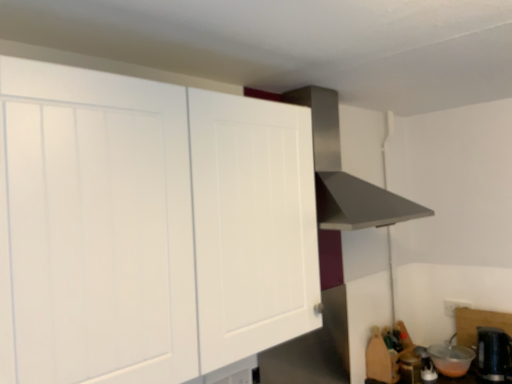
What do you see at coordinates (494, 354) in the screenshot? The width and height of the screenshot is (512, 384). I see `black plastic kettle at lower right, the fourth appliance positioned from the left` at bounding box center [494, 354].

Image resolution: width=512 pixels, height=384 pixels. What do you see at coordinates (410, 368) in the screenshot?
I see `metallic silver toaster at lower right, placed as the first appliance when sorted from left to right` at bounding box center [410, 368].

How much space does white glossy kettle at lower right, which is the 3th appliance in right-to-left order, occupy vertically?

white glossy kettle at lower right, which is the 3th appliance in right-to-left order, is 3.11 inches tall.

I want to click on white matte cabinet at upper left, so click(x=148, y=227).

From the image's perspective, would you say metallic silver toaster at lower right, placed as the first appliance when sorted from left to right, is shown under white glossy kettle at lower right, acting as the 2th appliance starting from the left?

No, from the image's perspective, metallic silver toaster at lower right, placed as the first appliance when sorted from left to right, is not beneath white glossy kettle at lower right, acting as the 2th appliance starting from the left.

Considering the sizes of objects metallic silver toaster at lower right, placed as the first appliance when sorted from left to right, and white glossy kettle at lower right, which is the 3th appliance in right-to-left order, in the image provided, who is thinner, metallic silver toaster at lower right, placed as the first appliance when sorted from left to right, or white glossy kettle at lower right, which is the 3th appliance in right-to-left order,?

white glossy kettle at lower right, which is the 3th appliance in right-to-left order.

Identify the location of the 2nd appliance located beneath the metallic silver toaster at lower right, which is the 4th appliance in right-to-left order (from a real-world perspective). pos(426,365).

Which of these two, transparent plastic bowl at lower right, the 2th appliance viewed from the right, or metallic silver toaster at lower right, which is the 4th appliance in right-to-left order, stands shorter?

transparent plastic bowl at lower right, the 2th appliance viewed from the right, is shorter.

Would you say transparent plastic bowl at lower right, which appears as the third appliance when viewed from the left, is outside metallic silver toaster at lower right, placed as the first appliance when sorted from left to right?

transparent plastic bowl at lower right, which appears as the third appliance when viewed from the left, lies outside metallic silver toaster at lower right, placed as the first appliance when sorted from left to right,'s area.

Which is in front, transparent plastic bowl at lower right, the 2th appliance viewed from the right, or metallic silver toaster at lower right, which is the 4th appliance in right-to-left order?

Positioned in front is metallic silver toaster at lower right, which is the 4th appliance in right-to-left order.

Which of these two, transparent plastic bowl at lower right, which appears as the third appliance when viewed from the left, or metallic silver toaster at lower right, which is the 4th appliance in right-to-left order, is smaller?

With smaller size is metallic silver toaster at lower right, which is the 4th appliance in right-to-left order.

Can you confirm if white glossy kettle at lower right, which is the 3th appliance in right-to-left order, is taller than black plastic kettle at lower right, the fourth appliance positioned from the left?

Incorrect, the height of white glossy kettle at lower right, which is the 3th appliance in right-to-left order, is not larger of that of black plastic kettle at lower right, the fourth appliance positioned from the left.

Which appliance is the 3rd one when counting from the front of the white glossy kettle at lower right, acting as the 2th appliance starting from the left? Please provide its 2D coordinates.

[(494, 354)]

Does white glossy kettle at lower right, which is the 3th appliance in right-to-left order, have a smaller size compared to black plastic kettle at lower right, the fourth appliance positioned from the left?

Correct, white glossy kettle at lower right, which is the 3th appliance in right-to-left order, occupies less space than black plastic kettle at lower right, the fourth appliance positioned from the left.

Is white glossy kettle at lower right, acting as the 2th appliance starting from the left, directly adjacent to black plastic kettle at lower right, which ranks as the 1th appliance in right-to-left order?

No, white glossy kettle at lower right, acting as the 2th appliance starting from the left, is not making contact with black plastic kettle at lower right, which ranks as the 1th appliance in right-to-left order.

Is stainless steel vent at upper center at the right side of white glossy kettle at lower right, acting as the 2th appliance starting from the left?

No, stainless steel vent at upper center is not to the right of white glossy kettle at lower right, acting as the 2th appliance starting from the left.

From the picture: Relative to white glossy kettle at lower right, acting as the 2th appliance starting from the left, is stainless steel vent at upper center in front or behind?

In the image, stainless steel vent at upper center appears in front of white glossy kettle at lower right, acting as the 2th appliance starting from the left.

Is white glossy kettle at lower right, which is the 3th appliance in right-to-left order, inside stainless steel vent at upper center?

No, stainless steel vent at upper center does not contain white glossy kettle at lower right, which is the 3th appliance in right-to-left order.

At what (x,y) coordinates should I click in order to perform the action: click on vent above the white glossy kettle at lower right, which is the 3th appliance in right-to-left order (from the image's perspective). Please return your answer as a coordinate pair (x, y). This screenshot has width=512, height=384. Looking at the image, I should click on (345, 174).

What's the angular difference between transparent plastic bowl at lower right, which appears as the third appliance when viewed from the left, and white glossy kettle at lower right, acting as the 2th appliance starting from the left,'s facing directions?

0.00352 degrees.

Does transparent plastic bowl at lower right, which appears as the third appliance when viewed from the left, touch white glossy kettle at lower right, acting as the 2th appliance starting from the left?

No, transparent plastic bowl at lower right, which appears as the third appliance when viewed from the left, is not next to white glossy kettle at lower right, acting as the 2th appliance starting from the left.

Find the location of a particular element. Image resolution: width=512 pixels, height=384 pixels. appliance that is the 1st one above the white glossy kettle at lower right, which is the 3th appliance in right-to-left order (from a real-world perspective) is located at coordinates (451, 359).

Is transparent plastic bowl at lower right, the 2th appliance viewed from the right, looking in the opposite direction of stainless steel vent at upper center?

That's not correct — transparent plastic bowl at lower right, the 2th appliance viewed from the right, is not looking away from stainless steel vent at upper center.

Considering the relative positions of transparent plastic bowl at lower right, which appears as the third appliance when viewed from the left, and stainless steel vent at upper center in the image provided, is transparent plastic bowl at lower right, which appears as the third appliance when viewed from the left, in front of stainless steel vent at upper center?

No, transparent plastic bowl at lower right, which appears as the third appliance when viewed from the left, is further to the viewer.

In terms of width, does transparent plastic bowl at lower right, which appears as the third appliance when viewed from the left, look wider or thinner when compared to stainless steel vent at upper center?

Clearly, transparent plastic bowl at lower right, which appears as the third appliance when viewed from the left, has less width compared to stainless steel vent at upper center.

From a real-world perspective, is transparent plastic bowl at lower right, which appears as the third appliance when viewed from the left, physically located above or below stainless steel vent at upper center?

transparent plastic bowl at lower right, which appears as the third appliance when viewed from the left, is below stainless steel vent at upper center.

In order to click on appliance that is the 4th one when counting downward from the stainless steel vent at upper center (from the image's perspective) in this screenshot , I will do `click(426, 365)`.

What's the angular difference between white glossy kettle at lower right, acting as the 2th appliance starting from the left, and stainless steel vent at upper center's facing directions?

white glossy kettle at lower right, acting as the 2th appliance starting from the left, and stainless steel vent at upper center are facing 88.5 degrees away from each other.

Consider the image. Between white glossy kettle at lower right, acting as the 2th appliance starting from the left, and stainless steel vent at upper center, which one has smaller size?

white glossy kettle at lower right, acting as the 2th appliance starting from the left, is smaller.

Looking at their sizes, would you say white glossy kettle at lower right, acting as the 2th appliance starting from the left, is wider or thinner than stainless steel vent at upper center?

Considering their sizes, white glossy kettle at lower right, acting as the 2th appliance starting from the left, looks slimmer than stainless steel vent at upper center.

From the image's perspective, count 1st appliances upward from the white glossy kettle at lower right, which is the 3th appliance in right-to-left order, and point to it. Please provide its 2D coordinates.

[(410, 368)]

In order to click on appliance that is the 1st object above the transparent plastic bowl at lower right, which appears as the third appliance when viewed from the left (from a real-world perspective) in this screenshot , I will do `click(410, 368)`.

When comparing their distances from white matte cabinet at upper left, does stainless steel vent at upper center or black plastic kettle at lower right, which ranks as the 1th appliance in right-to-left order, seem further?

Among the two, black plastic kettle at lower right, which ranks as the 1th appliance in right-to-left order, is located further to white matte cabinet at upper left.

From the image, which object appears to be nearer to metallic silver toaster at lower right, placed as the first appliance when sorted from left to right, white glossy kettle at lower right, which is the 3th appliance in right-to-left order, or transparent plastic bowl at lower right, which appears as the third appliance when viewed from the left?

Among the two, white glossy kettle at lower right, which is the 3th appliance in right-to-left order, is located nearer to metallic silver toaster at lower right, placed as the first appliance when sorted from left to right.

Estimate the real-world distances between objects in this image. Which object is further from white glossy kettle at lower right, acting as the 2th appliance starting from the left, transparent plastic bowl at lower right, which appears as the third appliance when viewed from the left, or metallic silver toaster at lower right, which is the 4th appliance in right-to-left order?

Among the two, transparent plastic bowl at lower right, which appears as the third appliance when viewed from the left, is located further to white glossy kettle at lower right, acting as the 2th appliance starting from the left.

Estimate the real-world distances between objects in this image. Which object is closer to stainless steel vent at upper center, black plastic kettle at lower right, the fourth appliance positioned from the left, or white matte cabinet at upper left?

The object closer to stainless steel vent at upper center is white matte cabinet at upper left.

Estimate the real-world distances between objects in this image. Which object is closer to transparent plastic bowl at lower right, the 2th appliance viewed from the right, white glossy kettle at lower right, which is the 3th appliance in right-to-left order, or metallic silver toaster at lower right, which is the 4th appliance in right-to-left order?

white glossy kettle at lower right, which is the 3th appliance in right-to-left order, is positioned closer to the anchor transparent plastic bowl at lower right, the 2th appliance viewed from the right.

Considering their positions, is transparent plastic bowl at lower right, which appears as the third appliance when viewed from the left, positioned closer to metallic silver toaster at lower right, placed as the first appliance when sorted from left to right, than white matte cabinet at upper left?

Based on the image, transparent plastic bowl at lower right, which appears as the third appliance when viewed from the left, appears to be nearer to metallic silver toaster at lower right, placed as the first appliance when sorted from left to right.

From the image, which object appears to be nearer to transparent plastic bowl at lower right, the 2th appliance viewed from the right, white matte cabinet at upper left or stainless steel vent at upper center?

stainless steel vent at upper center lies closer to transparent plastic bowl at lower right, the 2th appliance viewed from the right, than the other object.

When comparing their distances from stainless steel vent at upper center, does metallic silver toaster at lower right, placed as the first appliance when sorted from left to right, or black plastic kettle at lower right, the fourth appliance positioned from the left, seem closer?

Based on the image, metallic silver toaster at lower right, placed as the first appliance when sorted from left to right, appears to be nearer to stainless steel vent at upper center.

The width and height of the screenshot is (512, 384). What are the coordinates of `appliance situated between metallic silver toaster at lower right, placed as the first appliance when sorted from left to right, and transparent plastic bowl at lower right, the 2th appliance viewed from the right, from left to right` in the screenshot? It's located at (426, 365).

Image resolution: width=512 pixels, height=384 pixels. Identify the location of appliance between white glossy kettle at lower right, which is the 3th appliance in right-to-left order, and black plastic kettle at lower right, the fourth appliance positioned from the left. (451, 359).

I want to click on appliance between white matte cabinet at upper left and metallic silver toaster at lower right, which is the 4th appliance in right-to-left order, along the z-axis, so click(494, 354).

Where is `vent positioned between white matte cabinet at upper left and white glossy kettle at lower right, which is the 3th appliance in right-to-left order, from near to far`? This screenshot has height=384, width=512. vent positioned between white matte cabinet at upper left and white glossy kettle at lower right, which is the 3th appliance in right-to-left order, from near to far is located at coordinates (345, 174).